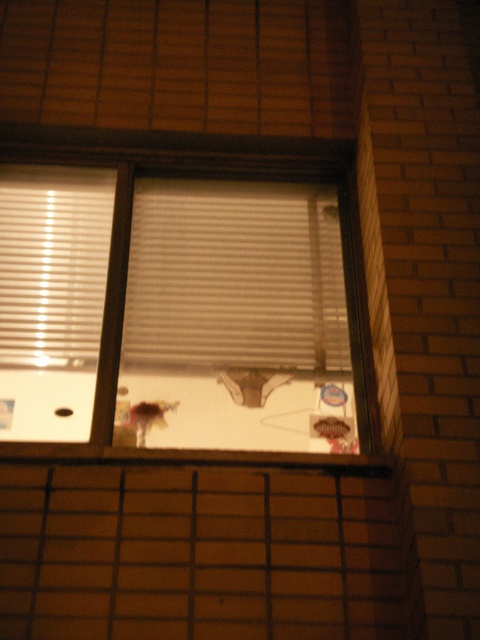
You are an interior designer assessing the space. You need to place a decorative plant pot that requires a surface area of 2 square feet. Which object between the white matte window at center and the smooth wood window sill at center would be suitable for placing the plant pot?

The white matte window at center is larger in size than the smooth wood window sill at center, so it has a bigger surface area and can accommodate the plant pot requiring 2 square feet.

You are standing in the room and see the white matte window at center and the white matte blinds at center. Which object is located to the left of the other?

The white matte window at center is positioned on the left side of white matte blinds at center.